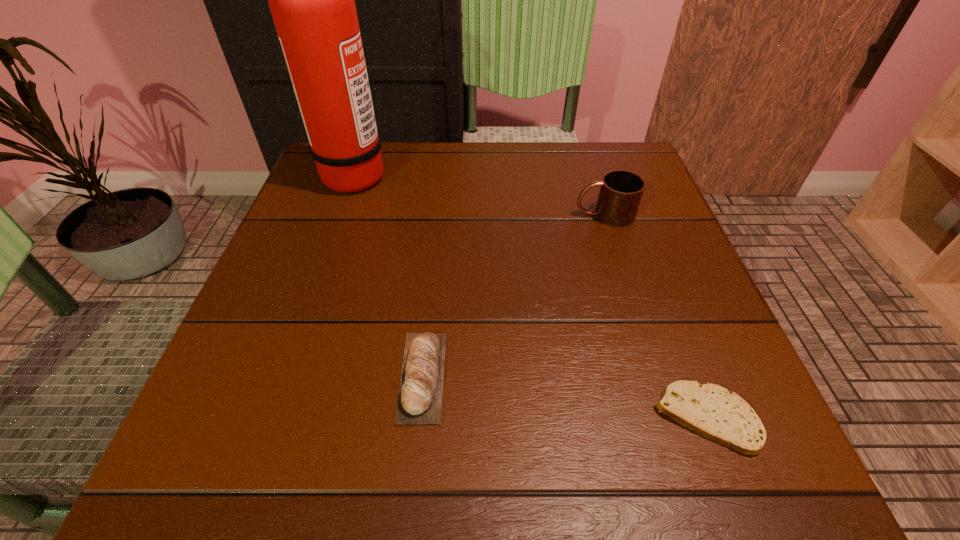
The height and width of the screenshot is (540, 960). Identify the location of vacant position located on the side of the mug with the handle. (414, 215).

You are a GUI agent. You are given a task and a screenshot of the screen. Output one action in this format:
    pyautogui.click(x=<x>, y=<y>)
    Task: Click on the vacant area located on the back of the taller pita bread
    The height and width of the screenshot is (540, 960).
    Given the screenshot: What is the action you would take?
    pyautogui.click(x=440, y=204)

Find the location of `vacant point located on the left of the shortest object`. vacant point located on the left of the shortest object is located at coordinates (492, 417).

Identify the location of object at the far edge. (312, 0).

This screenshot has height=540, width=960. I want to click on object situated at the left edge, so click(x=312, y=0).

This screenshot has width=960, height=540. Find the location of `mug positioned at the right edge`. mug positioned at the right edge is located at coordinates (620, 194).

Locate an element on the screen. pita bread located in the right edge section of the desktop is located at coordinates (710, 410).

Identify the location of object that is at the far left corner. (312, 0).

Locate an element on the screen. The image size is (960, 540). object present at the near right corner is located at coordinates (710, 410).

In the image, there is a desktop. Where is `vacant space at the far edge`? vacant space at the far edge is located at coordinates (571, 173).